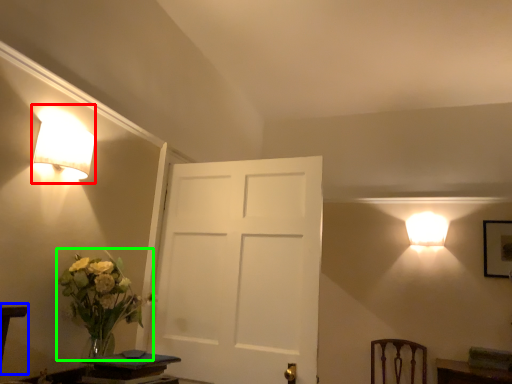
Question: Which object is the closest to the lamp (highlighted by a red box)? Choose among these: table (highlighted by a blue box) or floral arrangement (highlighted by a green box).

Choices:
 (A) table
 (B) floral arrangement

Answer: (B)